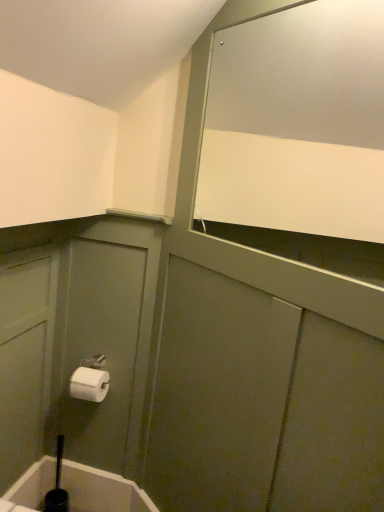
Question: Considering the relative sizes of black rubber toilet brush at lower left and white matte toilet paper at lower left in the image provided, is black rubber toilet brush at lower left smaller than white matte toilet paper at lower left?

Choices:
 (A) yes
 (B) no

Answer: (A)

Question: Is white matte toilet paper at lower left inside black rubber toilet brush at lower left?

Choices:
 (A) yes
 (B) no

Answer: (B)

Question: Is black rubber toilet brush at lower left outside white matte toilet paper at lower left?

Choices:
 (A) no
 (B) yes

Answer: (B)

Question: Does black rubber toilet brush at lower left have a greater width compared to white matte toilet paper at lower left?

Choices:
 (A) yes
 (B) no

Answer: (B)

Question: Does black rubber toilet brush at lower left have a larger size compared to white matte toilet paper at lower left?

Choices:
 (A) yes
 (B) no

Answer: (B)

Question: From the image's perspective, is black rubber toilet brush at lower left over white matte toilet paper at lower left?

Choices:
 (A) no
 (B) yes

Answer: (A)

Question: Does black rubber toilet brush at lower left touch white glossy mirror at upper right?

Choices:
 (A) no
 (B) yes

Answer: (A)

Question: Can you confirm if black rubber toilet brush at lower left is positioned to the left of white glossy mirror at upper right?

Choices:
 (A) yes
 (B) no

Answer: (A)

Question: Does black rubber toilet brush at lower left lie behind white glossy mirror at upper right?

Choices:
 (A) yes
 (B) no

Answer: (A)

Question: Considering the relative positions of black rubber toilet brush at lower left and white glossy mirror at upper right in the image provided, is black rubber toilet brush at lower left to the right of white glossy mirror at upper right from the viewer's perspective?

Choices:
 (A) no
 (B) yes

Answer: (A)

Question: Does black rubber toilet brush at lower left have a lesser height compared to white glossy mirror at upper right?

Choices:
 (A) no
 (B) yes

Answer: (B)

Question: Does black rubber toilet brush at lower left have a larger size compared to white glossy mirror at upper right?

Choices:
 (A) no
 (B) yes

Answer: (A)

Question: Does white matte toilet paper at lower left have a greater height compared to white glossy mirror at upper right?

Choices:
 (A) yes
 (B) no

Answer: (B)